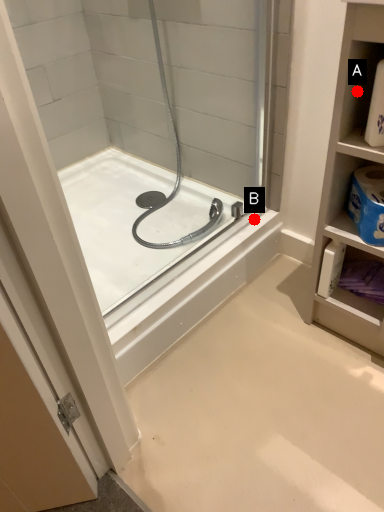
Question: Two points are circled on the image, labeled by A and B beside each circle. Among these points, which one is nearest to the camera?

Choices:
 (A) A is closer
 (B) B is closer

Answer: (A)